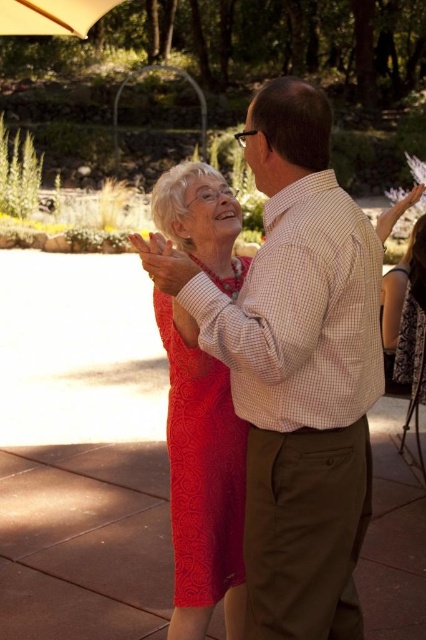
Which is more to the left, checkered fabric shirt at center or matte lace dress at center?

Positioned to the left is matte lace dress at center.

Does checkered fabric shirt at center have a greater height compared to matte lace dress at center?

Yes.

Is point (380, 348) closer to viewer compared to point (215, 570)?

Yes, it is in front of point (215, 570).

Find the location of a particular element. The image size is (426, 640). checkered fabric shirt at center is located at coordinates (296, 369).

In order to click on matte lace dress at center in this screenshot , I will do `click(201, 468)`.

Looking at this image, who is shorter, matte lace dress at center or beige fabric umbrella at upper left?

Standing shorter between the two is matte lace dress at center.

The image size is (426, 640). I want to click on matte lace dress at center, so click(x=201, y=468).

Does checkered fabric shirt at center appear over beige fabric umbrella at upper left?

Actually, checkered fabric shirt at center is below beige fabric umbrella at upper left.

Is point (339, 586) closer to viewer compared to point (23, 19)?

Yes, point (339, 586) is in front of point (23, 19).

The image size is (426, 640). I want to click on checkered fabric shirt at center, so click(x=296, y=369).